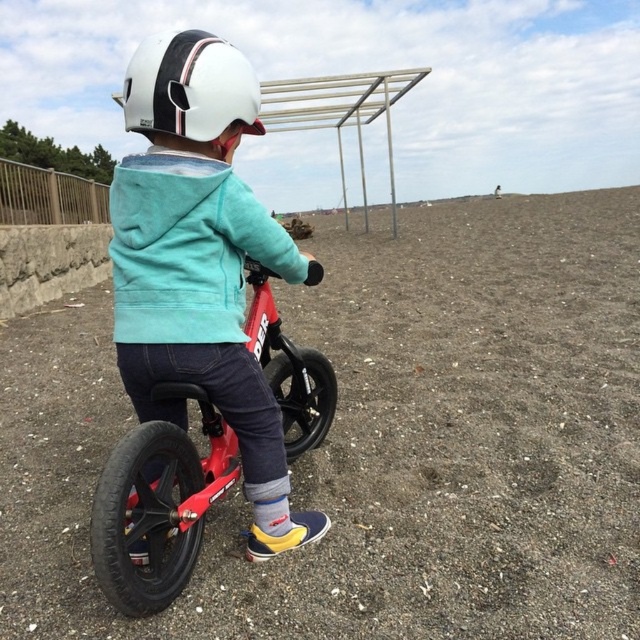
Does dull brown dirt at center appear on the left side of white matte helmet at upper center?

In fact, dull brown dirt at center is to the right of white matte helmet at upper center.

I want to click on dull brown dirt at center, so click(x=381, y=442).

The image size is (640, 640). I want to click on dull brown dirt at center, so click(x=381, y=442).

From the picture: Is dull brown dirt at center above shiny red bicycle at center?

Correct, dull brown dirt at center is located above shiny red bicycle at center.

Is dull brown dirt at center to the left of shiny red bicycle at center from the viewer's perspective?

Incorrect, dull brown dirt at center is not on the left side of shiny red bicycle at center.

Is point (632, 461) positioned before point (154, 420)?

No, it is behind (154, 420).

Find the location of a particular element. Image resolution: width=640 pixels, height=640 pixels. dull brown dirt at center is located at coordinates (381, 442).

Is shiny red bicycle at center in front of white matte helmet at upper center?

Yes, shiny red bicycle at center is closer to the viewer.

Measure the distance from shiny red bicycle at center to white matte helmet at upper center.

A distance of 28.48 inches exists between shiny red bicycle at center and white matte helmet at upper center.

Identify the location of shiny red bicycle at center. The image size is (640, 640). (157, 504).

Identify the location of shiny red bicycle at center. This screenshot has width=640, height=640. (157, 504).